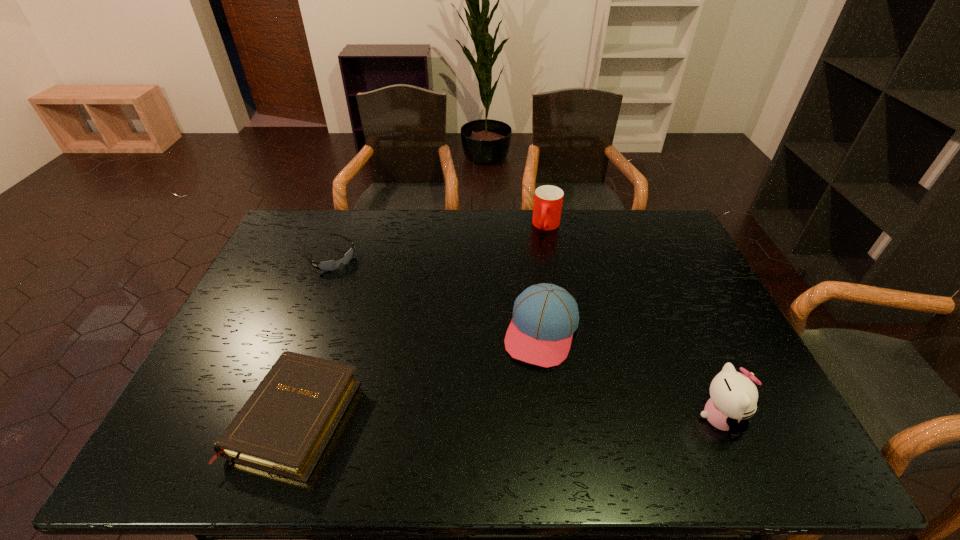
The image size is (960, 540). Find the location of `vacant space located on the lenses of the sunglasses`. vacant space located on the lenses of the sunglasses is located at coordinates (384, 307).

This screenshot has height=540, width=960. What are the coordinates of `vacant area located 0.100m on the lenses of the sunglasses` in the screenshot? It's located at (360, 284).

The height and width of the screenshot is (540, 960). What are the coordinates of `free space located 0.340m on the side of the farthest object with the handle` in the screenshot? It's located at (518, 299).

You are a GUI agent. You are given a task and a screenshot of the screen. Output one action in this format:
    pyautogui.click(x=<x>, y=<y>)
    Task: Click on the free spot located 0.050m on the side of the farthest object with the handle
    The height and width of the screenshot is (540, 960).
    Given the screenshot: What is the action you would take?
    pyautogui.click(x=540, y=245)

I want to click on vacant space located 0.070m on the side of the farthest object with the handle, so click(x=540, y=248).

Locate an element on the screen. Image resolution: width=960 pixels, height=540 pixels. blank space located 0.150m on the front-facing side of the baseball cap is located at coordinates (516, 416).

Where is `free space located on the front-facing side of the baseball cap`? This screenshot has width=960, height=540. free space located on the front-facing side of the baseball cap is located at coordinates (516, 412).

This screenshot has height=540, width=960. Identify the location of sunglasses present at the far edge. (330, 265).

Where is `cup that is at the far edge`? This screenshot has width=960, height=540. cup that is at the far edge is located at coordinates [548, 200].

In order to click on Bible that is at the near edge in this screenshot , I will do `click(283, 428)`.